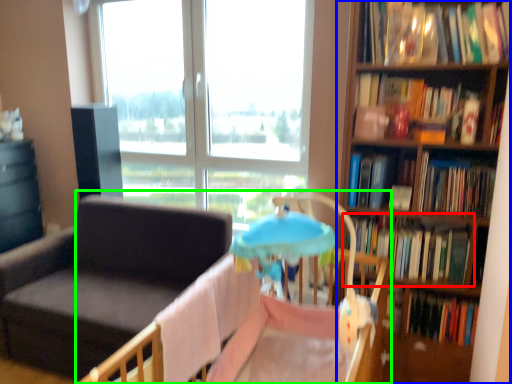
Question: Estimate the real-world distances between objects in this image. Which object is farther from book (highlighted by a red box), bookcase (highlighted by a blue box) or infant bed (highlighted by a green box)?

Choices:
 (A) bookcase
 (B) infant bed

Answer: (B)